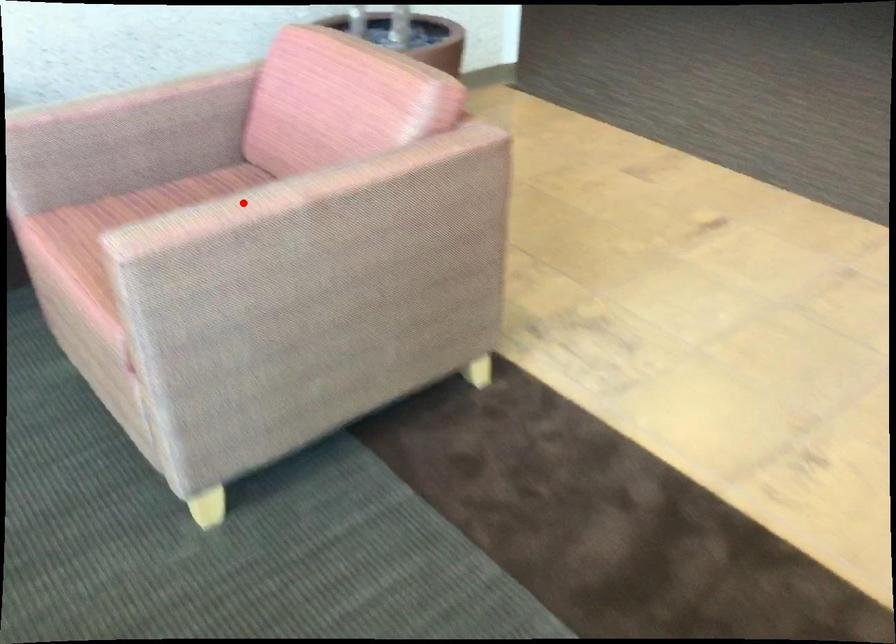
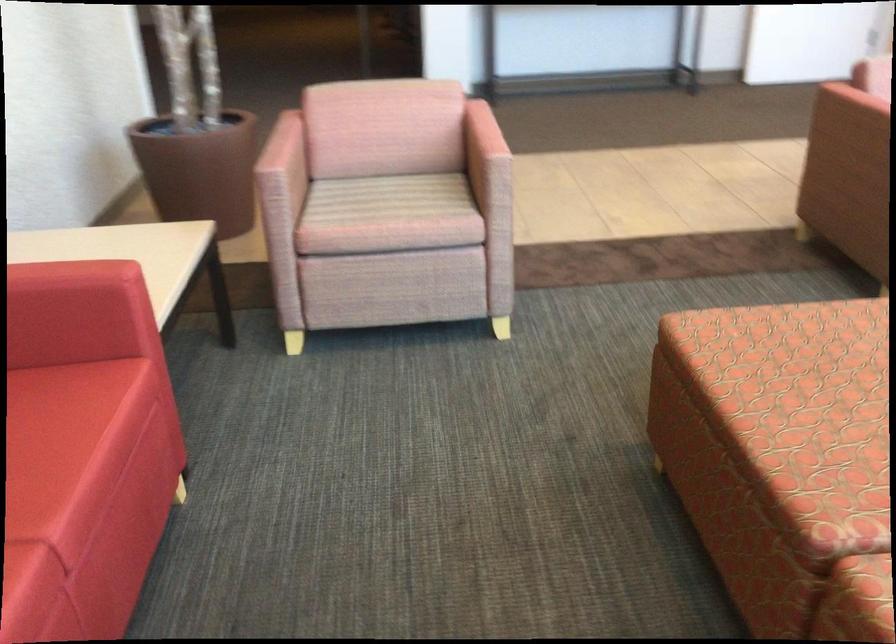
Question: I am providing you with two images of the same scene from different viewpoints. Given a red point in image1, look at the same physical point in image2. Is it:

Choices:
 (A) Closer to the viewpoint
 (B) Farther from the viewpoint

Answer: (B)